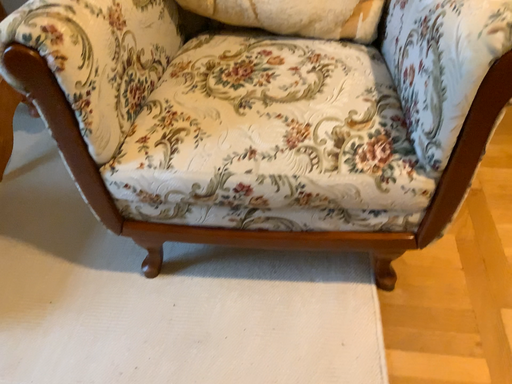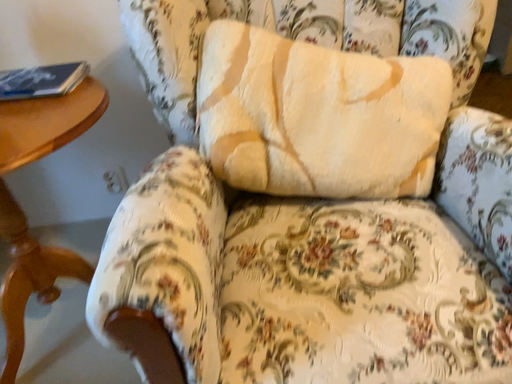
Question: How did the camera likely rotate when shooting the video?

Choices:
 (A) rotated upward
 (B) rotated downward

Answer: (A)